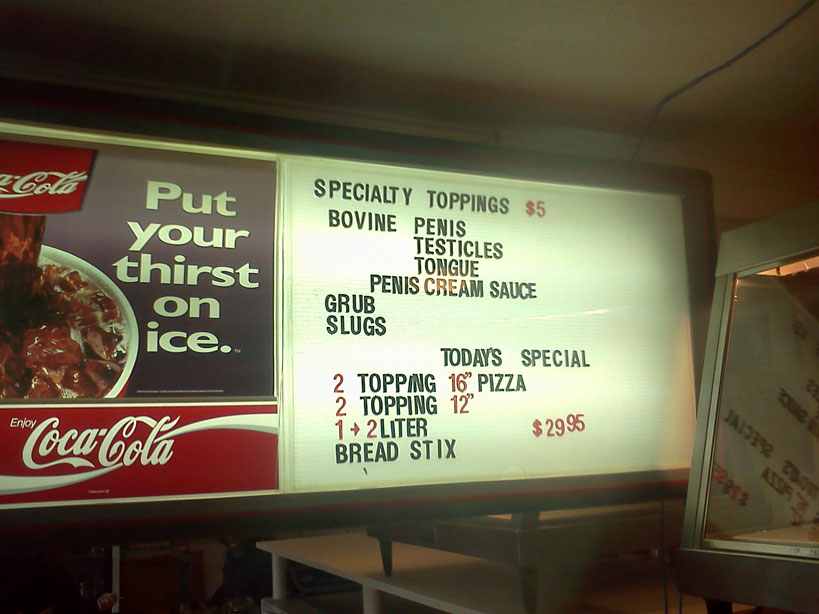
The height and width of the screenshot is (614, 819). I want to click on restaurant menu board, so click(x=319, y=342).